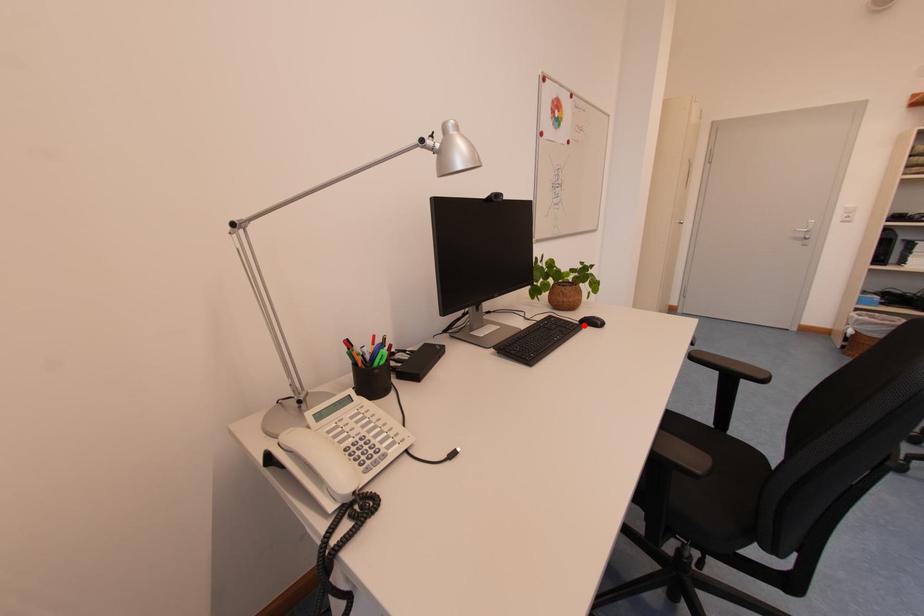
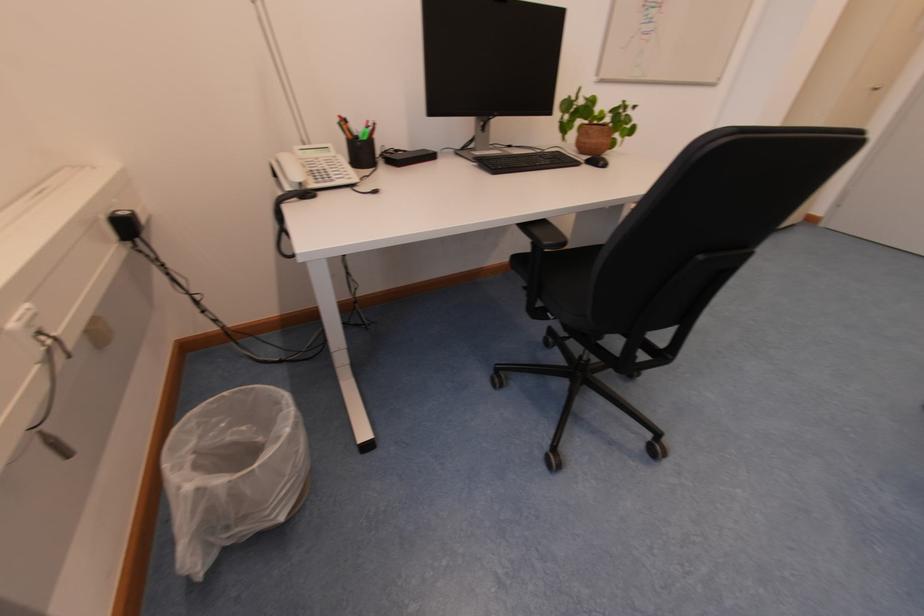
Question: I am providing you with two images of the same scene from different viewpoints. A red point is marked on the first image. Is the red point's position out of view in image 2?

Choices:
 (A) Yes
 (B) No

Answer: (B)